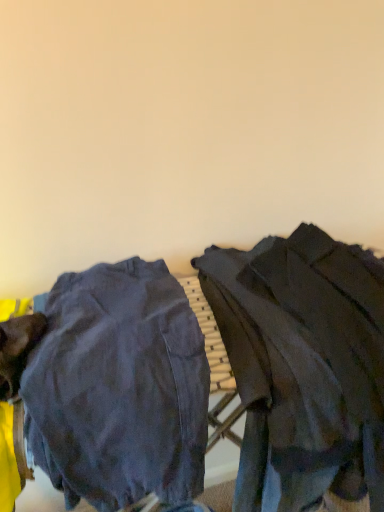
Question: Is dark gray fabric jacket at right inside dark denim pants at center?

Choices:
 (A) no
 (B) yes

Answer: (A)

Question: Is the position of dark denim pants at center more distant than that of dark gray fabric jacket at right?

Choices:
 (A) yes
 (B) no

Answer: (B)

Question: From a real-world perspective, is dark denim pants at center below dark gray fabric jacket at right?

Choices:
 (A) no
 (B) yes

Answer: (B)

Question: Is dark denim pants at center wider than dark gray fabric jacket at right?

Choices:
 (A) no
 (B) yes

Answer: (A)

Question: Can you confirm if dark denim pants at center is taller than dark gray fabric jacket at right?

Choices:
 (A) no
 (B) yes

Answer: (A)

Question: Is the depth of dark denim pants at center less than that of dark gray fabric jacket at right?

Choices:
 (A) yes
 (B) no

Answer: (A)

Question: Is dark gray fabric jacket at right not within dark denim pants at center?

Choices:
 (A) no
 (B) yes

Answer: (B)

Question: Considering the relative sizes of dark gray fabric jacket at right and dark denim pants at center in the image provided, is dark gray fabric jacket at right taller than dark denim pants at center?

Choices:
 (A) no
 (B) yes

Answer: (B)

Question: From the image's perspective, is dark gray fabric jacket at right beneath dark denim pants at center?

Choices:
 (A) no
 (B) yes

Answer: (A)

Question: Does dark gray fabric jacket at right appear on the right side of dark denim pants at center?

Choices:
 (A) yes
 (B) no

Answer: (A)

Question: Can you confirm if dark gray fabric jacket at right is thinner than dark denim pants at center?

Choices:
 (A) no
 (B) yes

Answer: (A)

Question: From a real-world perspective, is dark gray fabric jacket at right beneath dark denim pants at center?

Choices:
 (A) no
 (B) yes

Answer: (A)

Question: From the image's perspective, is dark denim pants at center located above or below dark gray fabric jacket at right?

Choices:
 (A) above
 (B) below

Answer: (B)